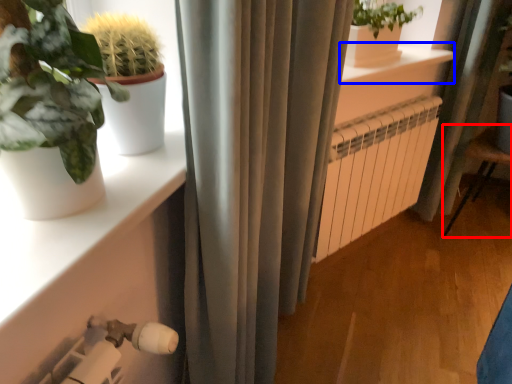
Question: Which object appears farthest to the camera in this image, armchair (highlighted by a red box) or window sill (highlighted by a blue box)?

Choices:
 (A) armchair
 (B) window sill

Answer: (A)